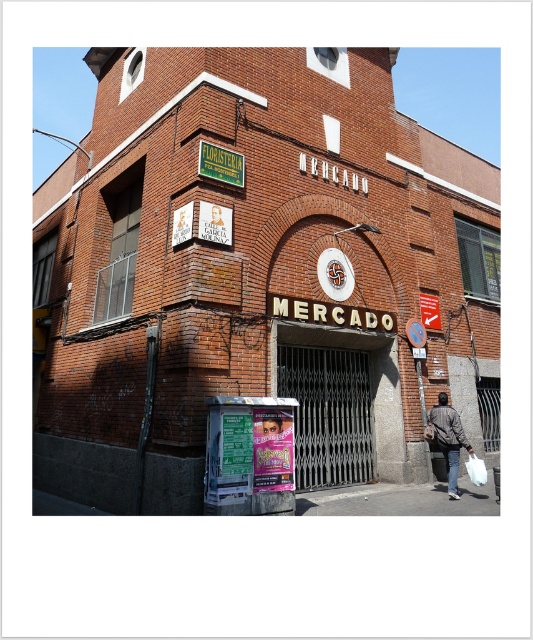
Question: Is brick building at center closer to camera compared to metallic poster at lower center?

Choices:
 (A) no
 (B) yes

Answer: (A)

Question: Which point is closer to the camera?

Choices:
 (A) (293, 401)
 (B) (78, 420)

Answer: (A)

Question: Which point is farther to the camera?

Choices:
 (A) (176, 272)
 (B) (241, 481)

Answer: (A)

Question: Does brick building at center appear over metallic poster at lower center?

Choices:
 (A) no
 (B) yes

Answer: (B)

Question: Is brick building at center to the right of metallic poster at lower center from the viewer's perspective?

Choices:
 (A) yes
 (B) no

Answer: (A)